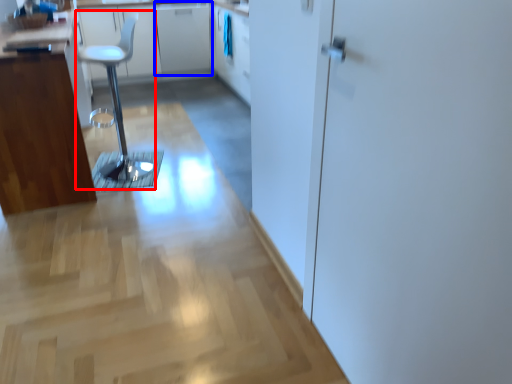
Question: Which point is further to the camera, step stool (highlighted by a red box) or cabinetry (highlighted by a blue box)?

Choices:
 (A) step stool
 (B) cabinetry

Answer: (B)